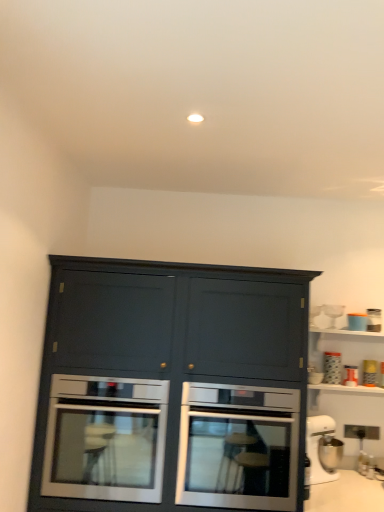
Question: Does white plastic stand mixer at lower right, which is the 7th appliance from top to bottom, contain metallic silver toaster at upper right, the second appliance from the top?

Choices:
 (A) no
 (B) yes

Answer: (A)

Question: Is white plastic stand mixer at lower right, the first appliance positioned from the bottom, oriented towards metallic silver toaster at upper right, the second appliance from the top?

Choices:
 (A) yes
 (B) no

Answer: (B)

Question: Is white plastic stand mixer at lower right, the first appliance positioned from the bottom, at the right side of metallic silver toaster at upper right, acting as the sixth appliance starting from the bottom?

Choices:
 (A) yes
 (B) no

Answer: (B)

Question: Considering the relative sizes of white plastic stand mixer at lower right, which is the 7th appliance from top to bottom, and metallic silver toaster at upper right, the second appliance from the top, in the image provided, is white plastic stand mixer at lower right, which is the 7th appliance from top to bottom, shorter than metallic silver toaster at upper right, the second appliance from the top,?

Choices:
 (A) no
 (B) yes

Answer: (A)

Question: Can you confirm if white plastic stand mixer at lower right, which is the 7th appliance from top to bottom, is taller than metallic silver toaster at upper right, acting as the sixth appliance starting from the bottom?

Choices:
 (A) no
 (B) yes

Answer: (B)

Question: Is white plastic stand mixer at lower right, the first appliance positioned from the bottom, in front of metallic silver toaster at upper right, the second appliance from the top?

Choices:
 (A) yes
 (B) no

Answer: (A)

Question: Is matte blue container at upper right, arranged as the fifth appliance when ordered from the bottom, turned away from matte dark blue cabinet at center?

Choices:
 (A) no
 (B) yes

Answer: (A)

Question: Would you consider matte blue container at upper right, arranged as the fifth appliance when ordered from the bottom, to be distant from matte dark blue cabinet at center?

Choices:
 (A) yes
 (B) no

Answer: (A)

Question: Considering the relative sizes of matte blue container at upper right, arranged as the fifth appliance when ordered from the bottom, and matte dark blue cabinet at center in the image provided, is matte blue container at upper right, arranged as the fifth appliance when ordered from the bottom, shorter than matte dark blue cabinet at center?

Choices:
 (A) yes
 (B) no

Answer: (A)

Question: Is matte blue container at upper right, arranged as the fifth appliance when ordered from the bottom, at the left side of matte dark blue cabinet at center?

Choices:
 (A) yes
 (B) no

Answer: (B)

Question: Considering the relative positions of matte blue container at upper right, arranged as the fifth appliance when ordered from the bottom, and matte dark blue cabinet at center in the image provided, is matte blue container at upper right, arranged as the fifth appliance when ordered from the bottom, to the right of matte dark blue cabinet at center from the viewer's perspective?

Choices:
 (A) no
 (B) yes

Answer: (B)

Question: From a real-world perspective, is matte blue container at upper right, the 3th appliance when ordered from top to bottom, on top of matte dark blue cabinet at center?

Choices:
 (A) no
 (B) yes

Answer: (B)

Question: Is clear glass wine glass at upper right, the seventh appliance in the bottom-to-top sequence, to the right of matte dark blue cabinet at center from the viewer's perspective?

Choices:
 (A) no
 (B) yes

Answer: (B)